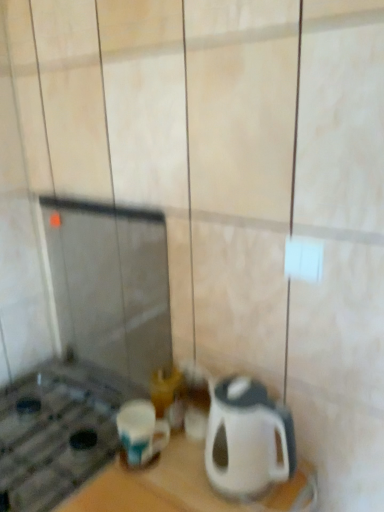
Question: From the image's perspective, is blue glossy mug at lower left over white glossy kettle at lower right?

Choices:
 (A) yes
 (B) no

Answer: (B)

Question: Does blue glossy mug at lower left have a greater width compared to white glossy kettle at lower right?

Choices:
 (A) yes
 (B) no

Answer: (B)

Question: Does blue glossy mug at lower left have a larger size compared to white glossy kettle at lower right?

Choices:
 (A) no
 (B) yes

Answer: (A)

Question: Is white glossy kettle at lower right a part of blue glossy mug at lower left?

Choices:
 (A) yes
 (B) no

Answer: (B)

Question: Is blue glossy mug at lower left in front of white glossy kettle at lower right?

Choices:
 (A) no
 (B) yes

Answer: (A)

Question: Is blue glossy mug at lower left oriented away from white glossy kettle at lower right?

Choices:
 (A) yes
 (B) no

Answer: (B)

Question: From a real-world perspective, is white glossy kettle at lower right located beneath blue glossy mug at lower left?

Choices:
 (A) no
 (B) yes

Answer: (A)

Question: From the image's perspective, is white glossy kettle at lower right located beneath blue glossy mug at lower left?

Choices:
 (A) no
 (B) yes

Answer: (A)

Question: From a real-world perspective, is white glossy kettle at lower right physically above blue glossy mug at lower left?

Choices:
 (A) yes
 (B) no

Answer: (A)

Question: Does white glossy kettle at lower right come behind blue glossy mug at lower left?

Choices:
 (A) yes
 (B) no

Answer: (B)

Question: Considering the relative sizes of white glossy kettle at lower right and blue glossy mug at lower left in the image provided, is white glossy kettle at lower right smaller than blue glossy mug at lower left?

Choices:
 (A) yes
 (B) no

Answer: (B)

Question: Can you confirm if white glossy kettle at lower right is thinner than blue glossy mug at lower left?

Choices:
 (A) no
 (B) yes

Answer: (A)

Question: Is white glossy kettle at lower right spatially inside blue glossy mug at lower left, or outside of it?

Choices:
 (A) inside
 (B) outside

Answer: (B)